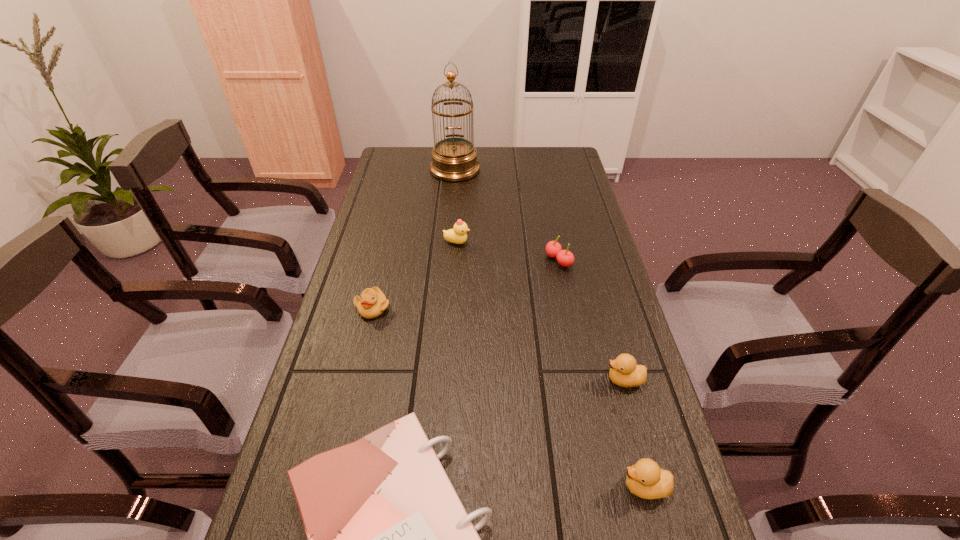
Locate an element on the screen. This screenshot has width=960, height=540. vacant space located on the front-facing side of the sixth nearest object is located at coordinates (597, 242).

Locate an element on the screen. The height and width of the screenshot is (540, 960). free space located on the right of the third farthest object is located at coordinates (602, 260).

The height and width of the screenshot is (540, 960). What are the coordinates of `blank area located on the face of the nearest duckling` in the screenshot? It's located at (431, 487).

What are the coordinates of `vacant space positioned 0.110m on the face of the nearest duckling` in the screenshot? It's located at (563, 487).

Where is `free space located on the face of the nearest duckling`? Image resolution: width=960 pixels, height=540 pixels. free space located on the face of the nearest duckling is located at coordinates click(x=458, y=487).

The height and width of the screenshot is (540, 960). I want to click on vacant space located facing forward on the third nearest object, so click(435, 380).

You are a GUI agent. You are given a task and a screenshot of the screen. Output one action in this format:
    pyautogui.click(x=<x>, y=<y>)
    Task: Click on the free location located facing forward on the third nearest object
    This screenshot has width=960, height=540.
    Given the screenshot: What is the action you would take?
    pyautogui.click(x=457, y=380)

At what (x,y) coordinates should I click in order to perform the action: click on vacant space located 0.200m facing forward on the third nearest object. Please return your answer as a coordinate pair (x, y). The height and width of the screenshot is (540, 960). Looking at the image, I should click on point(517,380).

At what (x,y) coordinates should I click in order to perform the action: click on free space located 0.050m on the front-facing side of the fourth farthest object. Please return your answer as a coordinate pair (x, y). The height and width of the screenshot is (540, 960). Looking at the image, I should click on (367, 336).

The height and width of the screenshot is (540, 960). In order to click on object positioned at the far edge in this screenshot , I will do tap(453, 159).